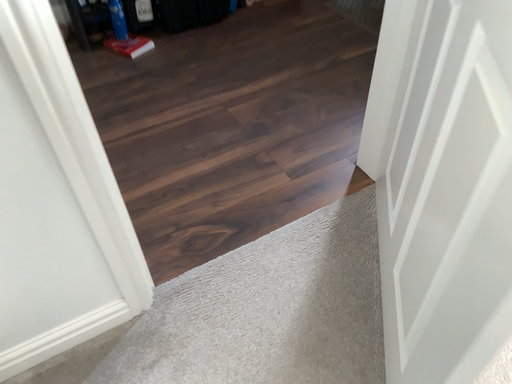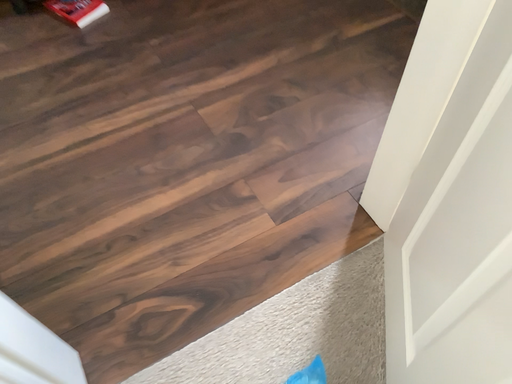
Question: Which way did the camera rotate in the video?

Choices:
 (A) rotated downward
 (B) rotated upward

Answer: (A)